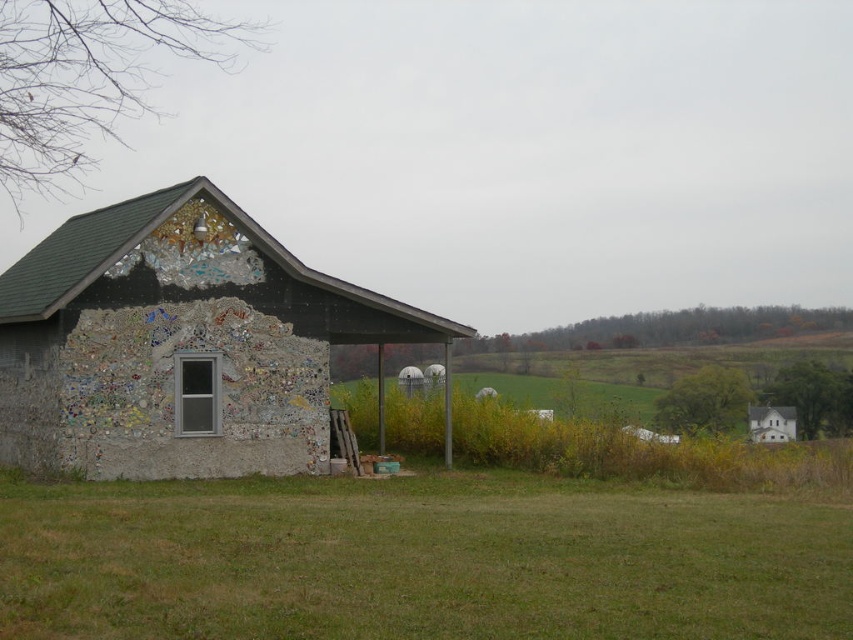
Is green grass at lower left shorter than decorative mosaic barn at left?

Indeed, green grass at lower left has a lesser height compared to decorative mosaic barn at left.

Is green grass at lower left wider than decorative mosaic barn at left?

Yes, green grass at lower left is wider than decorative mosaic barn at left.

Who is more distant from viewer, (347, 536) or (15, 444)?

Point (15, 444)

Locate an element on the screen. The image size is (853, 640). green grass at lower left is located at coordinates (416, 561).